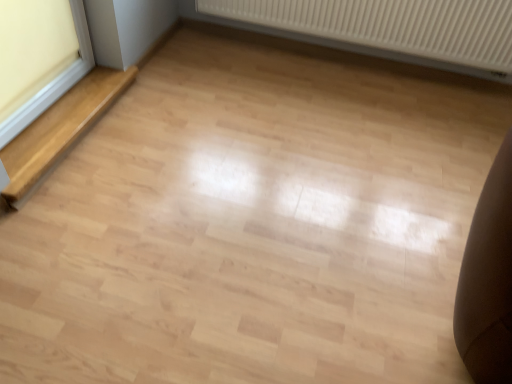
Question: Is light wood stairwell at left inside white ribbed radiator at upper center?

Choices:
 (A) yes
 (B) no

Answer: (B)

Question: Does white ribbed radiator at upper center have a greater height compared to light wood stairwell at left?

Choices:
 (A) yes
 (B) no

Answer: (A)

Question: From the image's perspective, is white ribbed radiator at upper center located beneath light wood stairwell at left?

Choices:
 (A) yes
 (B) no

Answer: (B)

Question: Does white ribbed radiator at upper center come behind light wood stairwell at left?

Choices:
 (A) yes
 (B) no

Answer: (A)

Question: From a real-world perspective, is white ribbed radiator at upper center positioned under light wood stairwell at left based on gravity?

Choices:
 (A) no
 (B) yes

Answer: (A)

Question: Does white ribbed radiator at upper center turn towards light wood stairwell at left?

Choices:
 (A) yes
 (B) no

Answer: (A)

Question: Can you confirm if white ribbed radiator at upper center is positioned to the right of white plastic window frame at left?

Choices:
 (A) no
 (B) yes

Answer: (B)

Question: Is white ribbed radiator at upper center taller than white plastic window frame at left?

Choices:
 (A) yes
 (B) no

Answer: (B)

Question: Are white ribbed radiator at upper center and white plastic window frame at left making contact?

Choices:
 (A) yes
 (B) no

Answer: (B)

Question: From the image's perspective, does white ribbed radiator at upper center appear lower than white plastic window frame at left?

Choices:
 (A) yes
 (B) no

Answer: (B)

Question: From a real-world perspective, is white ribbed radiator at upper center below white plastic window frame at left?

Choices:
 (A) yes
 (B) no

Answer: (A)

Question: Would you say white ribbed radiator at upper center is outside white plastic window frame at left?

Choices:
 (A) yes
 (B) no

Answer: (A)

Question: From the image's perspective, is light wood stairwell at left under white plastic window frame at left?

Choices:
 (A) no
 (B) yes

Answer: (B)